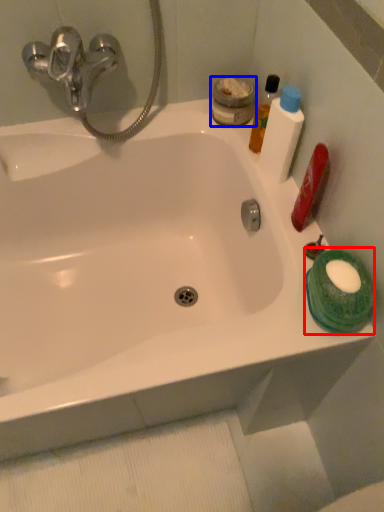
Question: Among these objects, which one is farthest to the camera, mouthwash (highlighted by a red box) or mouthwash (highlighted by a blue box)?

Choices:
 (A) mouthwash
 (B) mouthwash

Answer: (B)